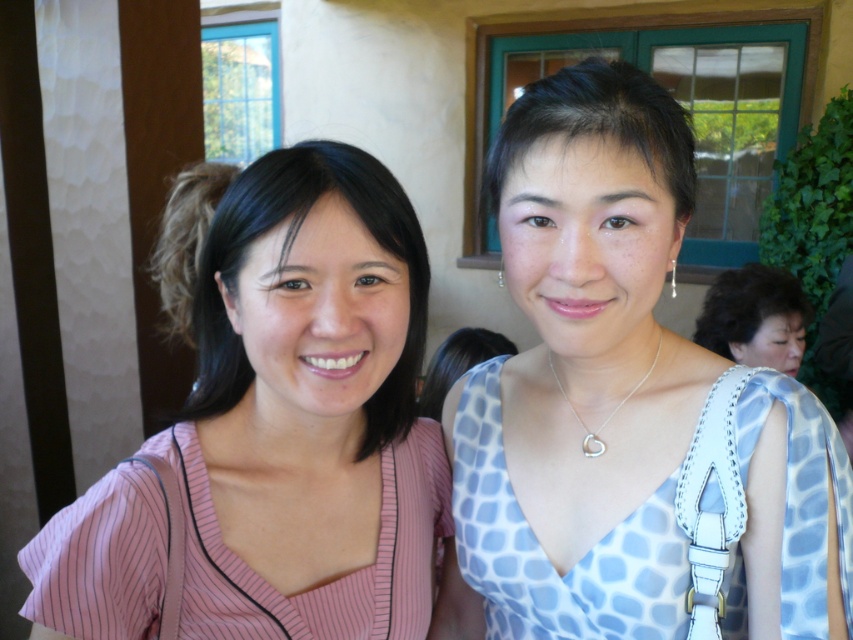
Question: Which object is the farthest from the light blue printed dress at center?

Choices:
 (A) light blue silk dress at center
 (B) light blue dotted dress at center
 (C) pink striped fabric dress at left
 (D) silver/smooth heart at center

Answer: (B)

Question: Considering the relative positions of light blue printed dress at center and light blue silk dress at center in the image provided, where is light blue printed dress at center located with respect to light blue silk dress at center?

Choices:
 (A) left
 (B) right

Answer: (A)

Question: Is light blue printed dress at center thinner than light blue dotted dress at center?

Choices:
 (A) yes
 (B) no

Answer: (A)

Question: Which object is the farthest from the pink striped fabric dress at left?

Choices:
 (A) light blue silk dress at center
 (B) light blue printed dress at center
 (C) light blue dotted dress at center
 (D) pink striped blouse at left

Answer: (C)

Question: Which point is farther from the camera taking this photo?

Choices:
 (A) (759, 275)
 (B) (587, 595)
 (C) (462, 474)

Answer: (A)

Question: Can you confirm if pink striped fabric dress at left is thinner than silver/smooth heart at center?

Choices:
 (A) no
 (B) yes

Answer: (A)